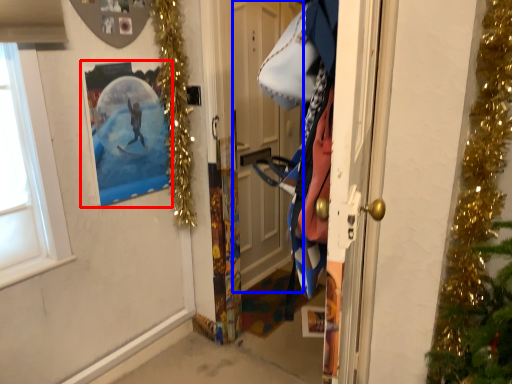
Question: Which object appears closest to the camera in this image, picture frame (highlighted by a red box) or door (highlighted by a blue box)?

Choices:
 (A) picture frame
 (B) door

Answer: (A)